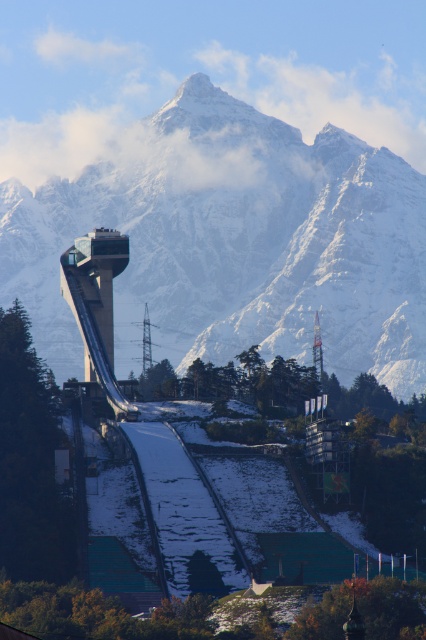
Question: Does snowy granite mountain range at center appear under matte glass tower at center?

Choices:
 (A) no
 (B) yes

Answer: (A)

Question: Does matte glass tower at center have a greater width compared to metallic transmission tower at center?

Choices:
 (A) yes
 (B) no

Answer: (A)

Question: Estimate the real-world distances between objects in this image. Which object is farther from the metallic transmission tower at center?

Choices:
 (A) matte glass tower at center
 (B) snowy granite mountain range at center
 (C) snowy white ski slope at center

Answer: (C)

Question: Which object is positioned closest to the metallic transmission tower at center?

Choices:
 (A) snowy white ski slope at center
 (B) matte glass tower at center

Answer: (B)

Question: Is snowy granite mountain range at center thinner than snowy white ski slope at center?

Choices:
 (A) yes
 (B) no

Answer: (B)

Question: Which of the following is the farthest from the observer?

Choices:
 (A) matte glass tower at center
 (B) metallic transmission tower at center
 (C) snowy white ski slope at center

Answer: (B)